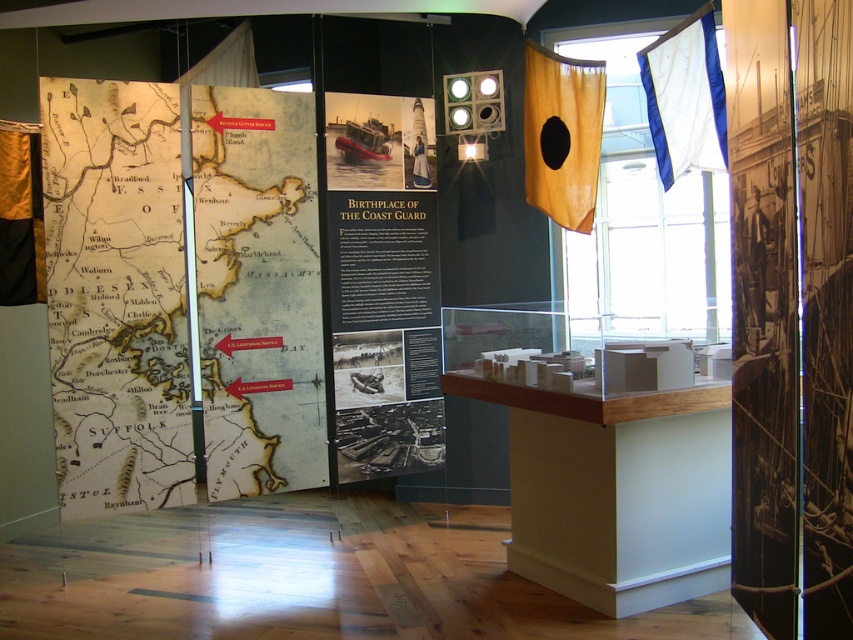
Question: Based on their relative distances, which object is nearer to the matte black sign at center?

Choices:
 (A) vintage paper map at left
 (B) white fabric flag at upper right
 (C) gold fabric curtain at left
 (D) yellow paper map at center

Answer: (D)

Question: Can you confirm if matte black sign at center is thinner than white fabric flag at upper right?

Choices:
 (A) no
 (B) yes

Answer: (A)

Question: Does white fabric flag at upper right lie in front of gold fabric curtain at left?

Choices:
 (A) no
 (B) yes

Answer: (B)

Question: Does yellow fabric flag at upper right come behind white fabric flag at upper right?

Choices:
 (A) no
 (B) yes

Answer: (B)

Question: Which point is farther to the camera?

Choices:
 (A) (697, 60)
 (B) (531, 109)
 (C) (258, 422)

Answer: (B)

Question: Estimate the real-world distances between objects in this image. Which object is closer to the yellow fabric flag at upper right?

Choices:
 (A) vintage paper map at left
 (B) yellow paper map at center
 (C) gold fabric curtain at left
 (D) white fabric flag at upper right

Answer: (D)